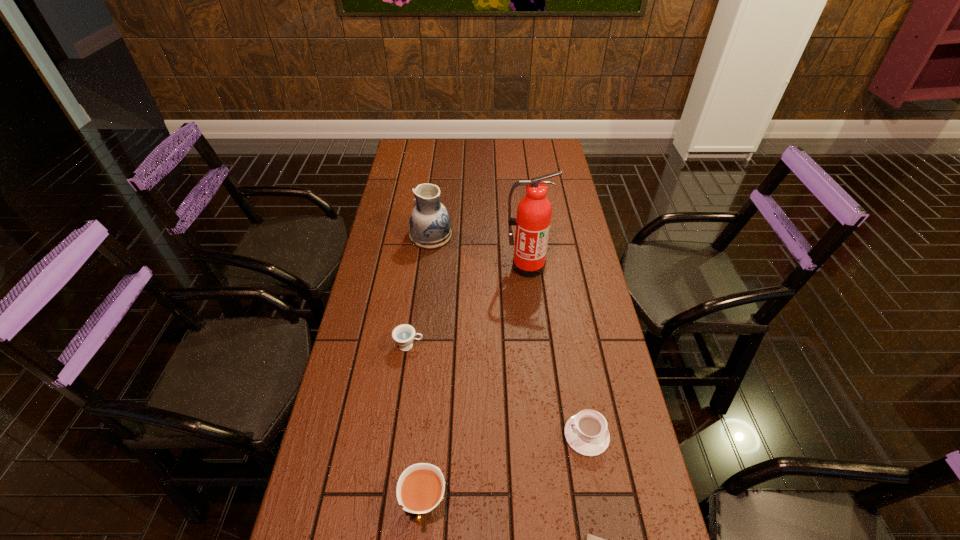
Identify the location of fire extinguisher. Image resolution: width=960 pixels, height=540 pixels. (534, 211).

Identify the location of the second farthest object. (534, 211).

What are the coordinates of `the fifth shortest object` in the screenshot? It's located at (429, 222).

Identify the location of pottery. (429, 222).

The width and height of the screenshot is (960, 540). In order to click on the tallest teacup in this screenshot , I will do `click(420, 488)`.

Find the location of a particular element. the second nearest object is located at coordinates (420, 488).

Where is `the third farthest object`? Image resolution: width=960 pixels, height=540 pixels. the third farthest object is located at coordinates (404, 334).

Identify the location of the third nearest object. (586, 432).

Find the location of `the second nearest teacup`. the second nearest teacup is located at coordinates (586, 432).

Locate an element on the screen. The width and height of the screenshot is (960, 540). free space located on the label side of the fire extinguisher is located at coordinates (532, 314).